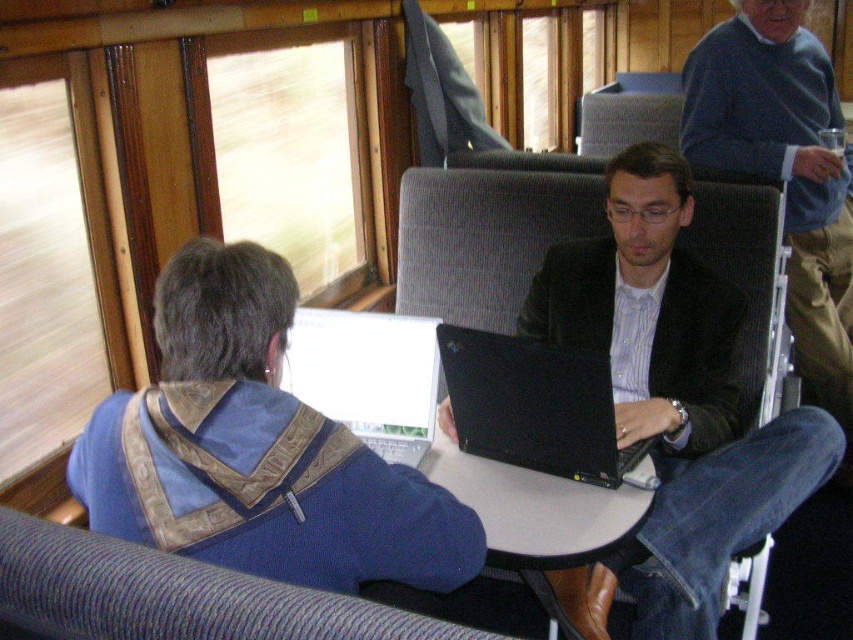
Question: Is black matte laptop at center further to the viewer compared to white glossy laptop at center?

Choices:
 (A) yes
 (B) no

Answer: (B)

Question: Which of the following is the farthest from the observer?

Choices:
 (A) matte black laptop at center
 (B) white plastic table at center
 (C) white glossy laptop at center

Answer: (C)

Question: Can you confirm if matte black laptop at center is positioned to the right of black matte laptop at center?

Choices:
 (A) yes
 (B) no

Answer: (A)

Question: Can you confirm if blue corduroy coach at upper right is wider than white plastic table at center?

Choices:
 (A) no
 (B) yes

Answer: (B)

Question: Which of the following is the farthest from the observer?

Choices:
 (A) black matte laptop at center
 (B) white glossy laptop at center
 (C) white plastic table at center
 (D) blue corduroy coach at upper right

Answer: (D)

Question: Which point appears closest to the camera in this image?

Choices:
 (A) (709, 54)
 (B) (703, 433)
 (C) (506, 368)

Answer: (C)